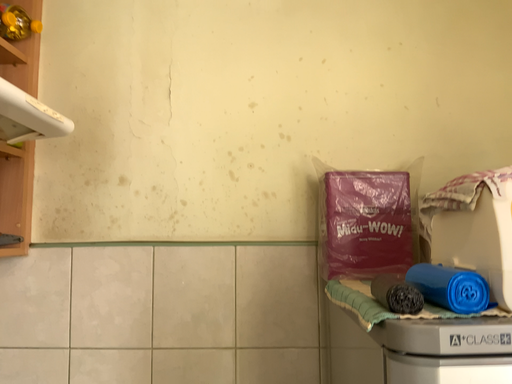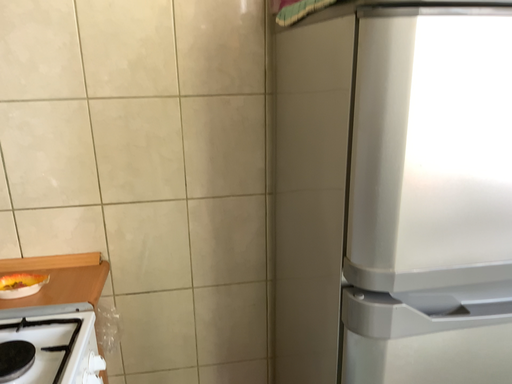
Question: How did the camera likely rotate when shooting the video?

Choices:
 (A) rotated left
 (B) rotated right

Answer: (B)